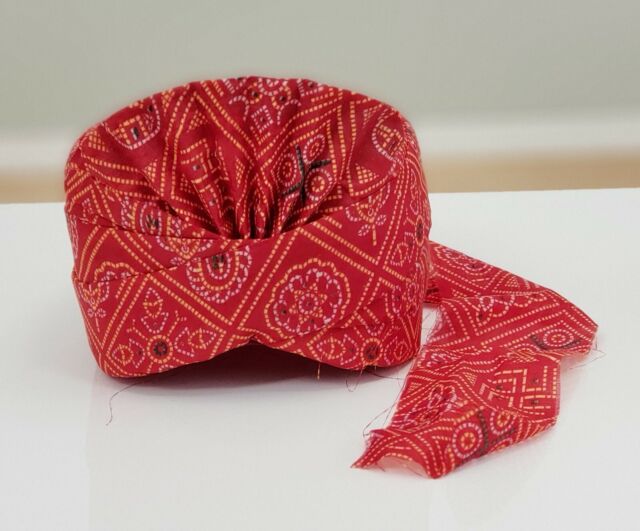
Locate an element on the screen. The image size is (640, 531). white surface is located at coordinates (296, 449).